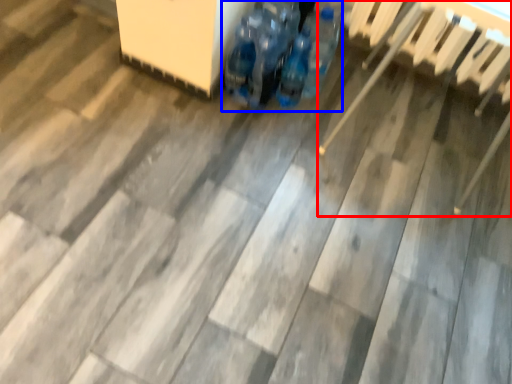
Question: Which point is further to the camera, chair (highlighted by a red box) or footwear (highlighted by a blue box)?

Choices:
 (A) chair
 (B) footwear

Answer: (B)